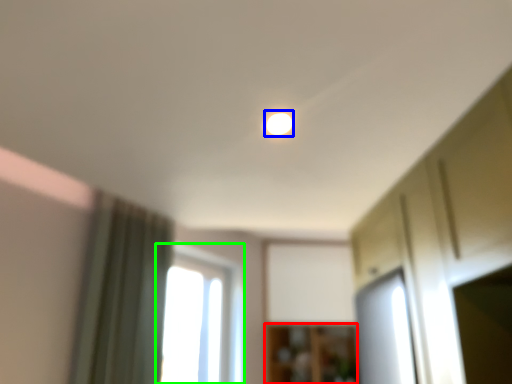
Question: Which object is positioned farthest from cabinetry (highlighted by a red box)? Select from light (highlighted by a blue box) and window (highlighted by a green box).

Choices:
 (A) light
 (B) window

Answer: (A)